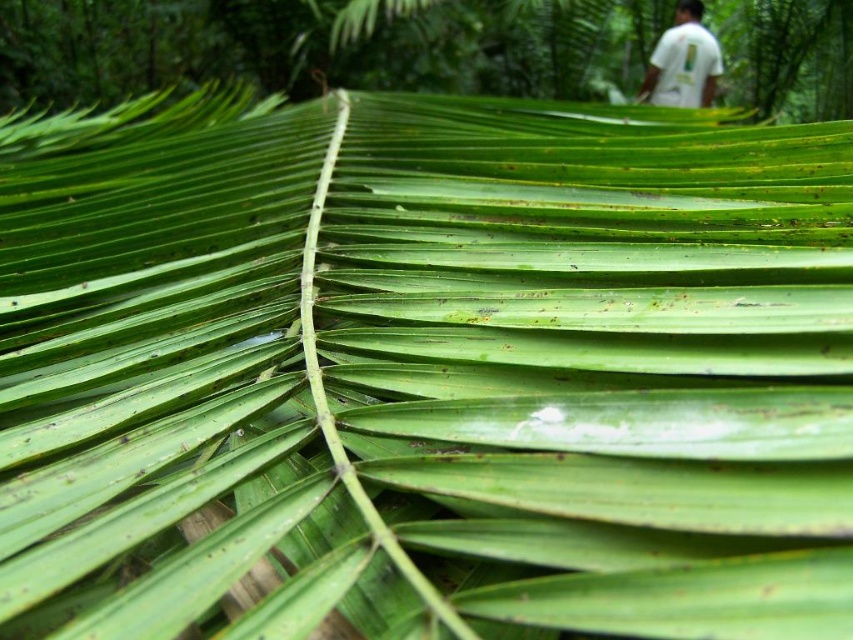
Does point (438, 19) come closer to viewer compared to point (666, 60)?

Yes, point (438, 19) is in front of point (666, 60).

Can you confirm if green leafy palm at upper center is positioned below white t-shirt at upper right?

Indeed, green leafy palm at upper center is positioned under white t-shirt at upper right.

Is point (415, 12) less distant than point (689, 13)?

Yes, it is in front of point (689, 13).

I want to click on green leafy palm at upper center, so click(x=326, y=45).